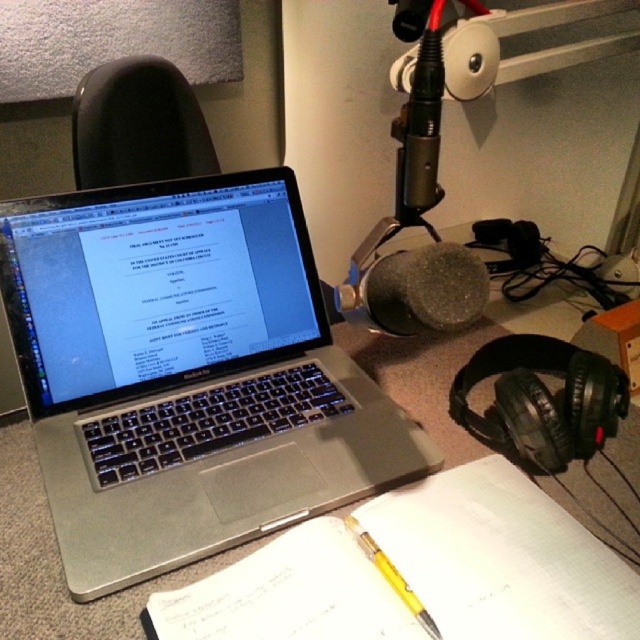
Question: Is black matte headphones at right to the right of spongy gray microphone at center from the viewer's perspective?

Choices:
 (A) no
 (B) yes

Answer: (B)

Question: Which object is the farthest from the white paper at center?

Choices:
 (A) silver metallic laptop at center
 (B) black matte headphones at right

Answer: (A)

Question: Does white paper at center have a smaller size compared to black matte headphones at right?

Choices:
 (A) yes
 (B) no

Answer: (B)

Question: Can you confirm if black matte headphones at right is positioned to the left of yellow translucent pencil at center?

Choices:
 (A) yes
 (B) no

Answer: (B)

Question: Which point is closer to the camera?

Choices:
 (A) (492, 524)
 (B) (432, 624)

Answer: (B)

Question: Which object appears closest to the camera in this image?

Choices:
 (A) white paper at center
 (B) silver metallic laptop at center

Answer: (A)